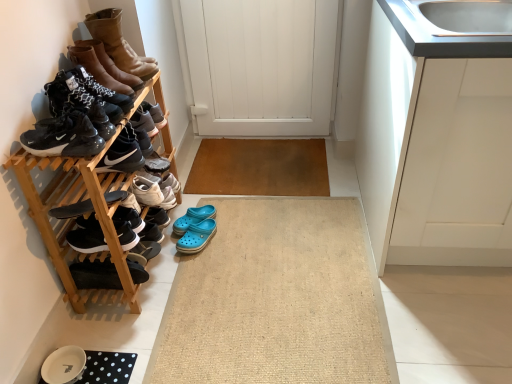
The width and height of the screenshot is (512, 384). In order to click on black matte sneakers at left, placed as the fifth footwear when sorted from bottom to top in this screenshot , I will do `click(64, 137)`.

What do you see at coordinates (197, 236) in the screenshot? I see `blue rubber clogs at center, the seventh footwear positioned from the top` at bounding box center [197, 236].

Where is `black matte sneakers at left, arranged as the fourth footwear when viewed from the top`? The height and width of the screenshot is (384, 512). black matte sneakers at left, arranged as the fourth footwear when viewed from the top is located at coordinates (64, 137).

In the scene shown: Is black suede sandal at lower left, which is the eighth footwear in top-to-bottom order, in contact with black suede sneakers at left, the 6th footwear ordered from the bottom?

No, black suede sandal at lower left, which is the eighth footwear in top-to-bottom order, is not next to black suede sneakers at left, the 6th footwear ordered from the bottom.

Is black suede sandal at lower left, acting as the 1th footwear starting from the bottom, bigger or smaller than black suede sneakers at left, positioned as the third footwear in top-to-bottom order?

black suede sandal at lower left, acting as the 1th footwear starting from the bottom, is smaller than black suede sneakers at left, positioned as the third footwear in top-to-bottom order.

From a real-world perspective, starting from the black suede sandal at lower left, which is the eighth footwear in top-to-bottom order, which footwear is the 4th one vertically above it? Please provide its 2D coordinates.

[(84, 94)]

Which is more to the left, black suede sandal at lower left, which is the eighth footwear in top-to-bottom order, or black suede sneakers at left, positioned as the third footwear in top-to-bottom order?

black suede sneakers at left, positioned as the third footwear in top-to-bottom order.

The image size is (512, 384). What are the coordinates of `the 1st footwear in front of the black matte shoe at left, acting as the fifth footwear starting from the top` in the screenshot? It's located at (84, 94).

From the picture: Is black suede sneakers at left, positioned as the third footwear in top-to-bottom order, thinner than black matte shoe at left, acting as the fifth footwear starting from the top?

No, black suede sneakers at left, positioned as the third footwear in top-to-bottom order, is not thinner than black matte shoe at left, acting as the fifth footwear starting from the top.

Is black suede sneakers at left, the 6th footwear ordered from the bottom, not inside black matte shoe at left, acting as the fifth footwear starting from the top?

Yes.

Can you tell me how much black suede sneakers at left, the 6th footwear ordered from the bottom, and black matte shoe at left, acting as the fifth footwear starting from the top, differ in facing direction?

40 degrees.

Is leather boots at upper left, which ranks as the eighth footwear in bottom-to-top order, beside black matte sneakers at upper left, which is the second shoe from bottom to top?

No, leather boots at upper left, which ranks as the eighth footwear in bottom-to-top order, is not touching black matte sneakers at upper left, which is the second shoe from bottom to top.

From a real-world perspective, starting from the black matte sneakers at upper left, which is the first shoe from top to bottom, which footwear is the 2nd one vertically above it? Please provide its 2D coordinates.

[(118, 43)]

Do you think leather boots at upper left, which ranks as the eighth footwear in bottom-to-top order, is within black matte sneakers at upper left, which is the second shoe from bottom to top, or outside of it?

leather boots at upper left, which ranks as the eighth footwear in bottom-to-top order, lies outside black matte sneakers at upper left, which is the second shoe from bottom to top.

Considering the relative sizes of leather boots at upper left, which is counted as the first footwear, starting from the top, and black matte sneakers at upper left, which is the second shoe from bottom to top, in the image provided, is leather boots at upper left, which is counted as the first footwear, starting from the top, bigger than black matte sneakers at upper left, which is the second shoe from bottom to top,?

Correct, leather boots at upper left, which is counted as the first footwear, starting from the top, is larger in size than black matte sneakers at upper left, which is the second shoe from bottom to top.

Are white wooden door at center and beige woven bath mat at center beside each other?

There is a gap between white wooden door at center and beige woven bath mat at center.

Considering the sizes of objects white wooden door at center and beige woven bath mat at center in the image provided, who is smaller, white wooden door at center or beige woven bath mat at center?

beige woven bath mat at center.

Is white wooden door at center taller than beige woven bath mat at center?

Indeed, white wooden door at center has a greater height compared to beige woven bath mat at center.

From the image's perspective, is black matte sneakers at lower left, which is counted as the 6th footwear, starting from the top, positioned above or below leather boots at upper left, which is counted as the first footwear, starting from the top?

black matte sneakers at lower left, which is counted as the 6th footwear, starting from the top, is below leather boots at upper left, which is counted as the first footwear, starting from the top.

Is black matte sneakers at lower left, which is counted as the 6th footwear, starting from the top, oriented away from leather boots at upper left, which ranks as the eighth footwear in bottom-to-top order?

No, black matte sneakers at lower left, which is counted as the 6th footwear, starting from the top, is not facing away from leather boots at upper left, which ranks as the eighth footwear in bottom-to-top order.

Does black matte sneakers at lower left, which ranks as the third footwear in bottom-to-top order, have a greater height compared to leather boots at upper left, which is counted as the first footwear, starting from the top?

Incorrect, the height of black matte sneakers at lower left, which ranks as the third footwear in bottom-to-top order, is not larger of that of leather boots at upper left, which is counted as the first footwear, starting from the top.

Would you say beige woven bath mat at center is inside or outside white wooden door at center?

beige woven bath mat at center is not inside white wooden door at center, it's outside.

Based on the photo, is beige woven bath mat at center far from white wooden door at center?

beige woven bath mat at center is far away from white wooden door at center.

Can you tell me how much beige woven bath mat at center and white wooden door at center differ in facing direction?

They differ by 90 degrees in their facing directions.

Is beige woven bath mat at center in front of or behind white wooden door at center in the image?

In the image, beige woven bath mat at center appears in front of white wooden door at center.

Is black matte sneakers at left, placed as the fifth footwear when sorted from bottom to top, wider or thinner than blue rubber clogs at center, the seventh footwear positioned from the top?

In the image, black matte sneakers at left, placed as the fifth footwear when sorted from bottom to top, appears to be more narrow than blue rubber clogs at center, the seventh footwear positioned from the top.

Is point (79, 118) in front of point (185, 237)?

Yes, point (79, 118) is in front of point (185, 237).

Is black matte sneakers at left, placed as the fifth footwear when sorted from bottom to top, surrounding blue rubber clogs at center, the seventh footwear positioned from the top?

Definitely not — blue rubber clogs at center, the seventh footwear positioned from the top, is not inside black matte sneakers at left, placed as the fifth footwear when sorted from bottom to top.

Locate an element on the screen. This screenshot has width=512, height=384. the 5th footwear behind the black suede sneakers at left, positioned as the third footwear in top-to-bottom order, starting your count from the anchor is located at coordinates (95, 275).

Find the location of a particular element. This screenshot has width=512, height=384. the 1st footwear counting from the left side of the black matte shoe at left, acting as the fifth footwear starting from the top is located at coordinates (84, 94).

Considering their positions, is wooden shoe rack at left positioned further to black matte sneakers at left, placed as the fifth footwear when sorted from bottom to top, than black suede sandal at lower left, which is the eighth footwear in top-to-bottom order?

black suede sandal at lower left, which is the eighth footwear in top-to-bottom order, lies further to black matte sneakers at left, placed as the fifth footwear when sorted from bottom to top, than the other object.

Which object lies further to the anchor point beige woven bath mat at center, black matte sneakers at upper left, which is the first shoe from top to bottom, or black matte sneakers at lower left, which ranks as the third footwear in bottom-to-top order?

black matte sneakers at upper left, which is the first shoe from top to bottom.

Looking at the image, which one is located closer to black matte sneakers at lower left, which is counted as the 6th footwear, starting from the top, black matte shoe at left, acting as the fifth footwear starting from the top, or wooden shoe rack at left?

black matte shoe at left, acting as the fifth footwear starting from the top, lies closer to black matte sneakers at lower left, which is counted as the 6th footwear, starting from the top, than the other object.

From the image, which object appears to be nearer to white matte cabinet at upper right, black suede shoe at lower left, the second shoe viewed from the top, or leather boots at upper left, which is counted as the first footwear, starting from the top?

The object closer to white matte cabinet at upper right is black suede shoe at lower left, the second shoe viewed from the top.

Based on the photo, from the image, which object appears to be nearer to black matte sneakers at upper left, which is the second shoe from bottom to top, wooden shoe rack at left or black suede shoe at lower left, the second shoe viewed from the top?

Among the two, wooden shoe rack at left is located nearer to black matte sneakers at upper left, which is the second shoe from bottom to top.

Which object lies further to the anchor point black matte sneakers at lower left, which is counted as the 6th footwear, starting from the top, black suede sneakers at left, positioned as the third footwear in top-to-bottom order, or black suede shoe at lower left, the 1th shoe ordered from the bottom?

Based on the image, black suede sneakers at left, positioned as the third footwear in top-to-bottom order, appears to be further to black matte sneakers at lower left, which is counted as the 6th footwear, starting from the top.

When comparing their distances from black suede sneakers at left, the 6th footwear ordered from the bottom, does leather boots at upper left, which is counted as the first footwear, starting from the top, or wooden shoe rack at left seem further?

leather boots at upper left, which is counted as the first footwear, starting from the top, is positioned further to the anchor black suede sneakers at left, the 6th footwear ordered from the bottom.

From the image, which object appears to be farther from leather boots at upper left, which ranks as the eighth footwear in bottom-to-top order, brown leather boots at upper left, which is the seventh footwear from bottom to top, or black suede shoe at lower left, the second shoe viewed from the top?

black suede shoe at lower left, the second shoe viewed from the top, is further to leather boots at upper left, which ranks as the eighth footwear in bottom-to-top order.

The height and width of the screenshot is (384, 512). I want to click on shelf that lies between black matte sneakers at upper left, which is the first shoe from top to bottom, and black suede sandal at lower left, which is the eighth footwear in top-to-bottom order, from top to bottom, so click(x=72, y=221).

Locate an element on the screen. shelf between black suede sneakers at left, the 6th footwear ordered from the bottom, and black suede shoe at lower left, the 1th shoe ordered from the bottom, from top to bottom is located at coordinates [x=72, y=221].

You are a GUI agent. You are given a task and a screenshot of the screen. Output one action in this format:
    pyautogui.click(x=<x>, y=<y>)
    Task: Click on the shoe between black matte shoe at left, acting as the fourth footwear starting from the bottom, and black suede sandal at lower left, which is the eighth footwear in top-to-bottom order, in the vertical direction
    The image size is (512, 384).
    Given the screenshot: What is the action you would take?
    pyautogui.click(x=129, y=218)

Locate an element on the screen. shelf between black matte sneakers at upper left, which is the second shoe from bottom to top, and black suede shoe at lower left, the 1th shoe ordered from the bottom, in the vertical direction is located at coordinates (72, 221).